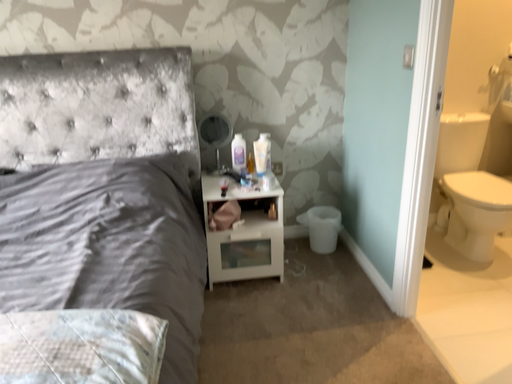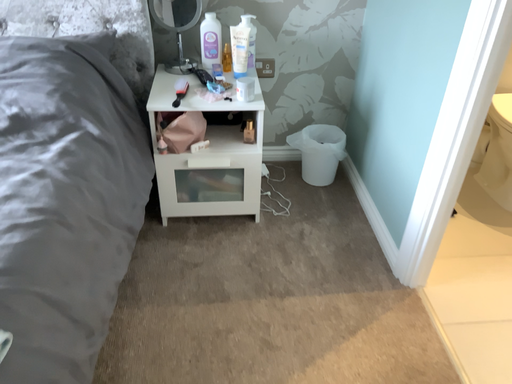
Question: How did the camera likely rotate when shooting the video?

Choices:
 (A) rotated downward
 (B) rotated upward

Answer: (A)